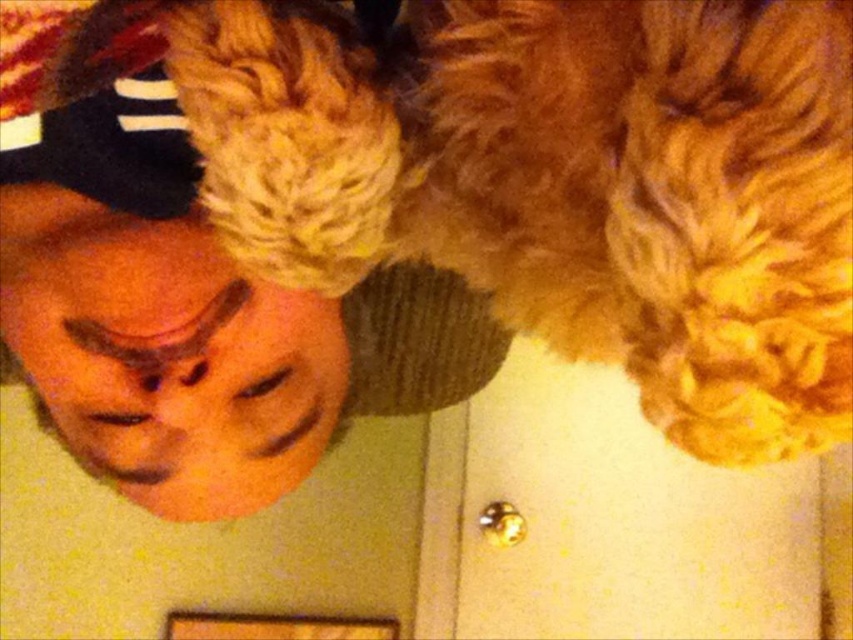
Question: Can you confirm if fuzzy golden cat at upper center is bigger than matte black cap at upper left?

Choices:
 (A) yes
 (B) no

Answer: (B)

Question: Which point is closer to the camera taking this photo?

Choices:
 (A) (764, 227)
 (B) (192, 268)

Answer: (A)

Question: Considering the relative positions of fuzzy golden cat at upper center and matte black cap at upper left in the image provided, where is fuzzy golden cat at upper center located with respect to matte black cap at upper left?

Choices:
 (A) left
 (B) right

Answer: (B)

Question: Does fuzzy golden cat at upper center have a smaller size compared to matte black cap at upper left?

Choices:
 (A) yes
 (B) no

Answer: (A)

Question: Which point is closer to the camera taking this photo?

Choices:
 (A) (212, 168)
 (B) (141, 177)

Answer: (A)